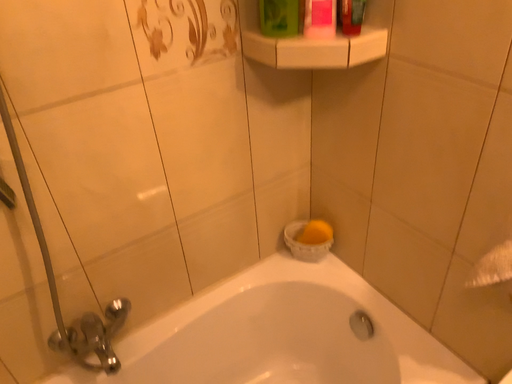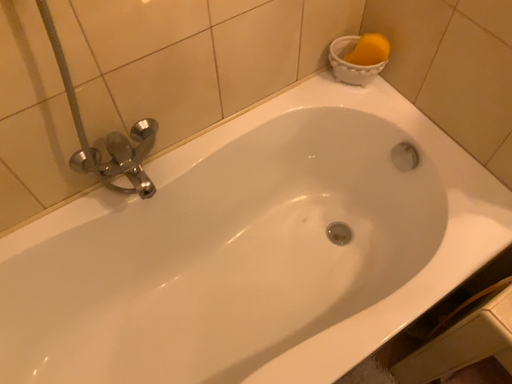
Question: Which way did the camera rotate in the video?

Choices:
 (A) rotated upward
 (B) rotated downward

Answer: (B)